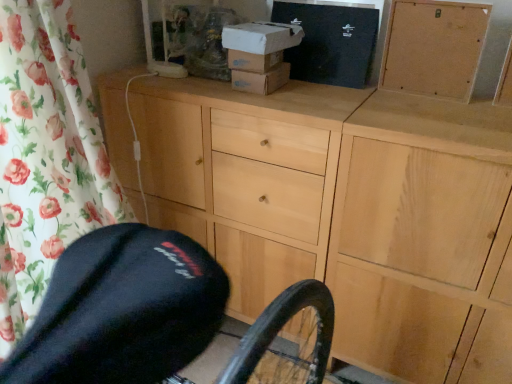
In order to face light wood cabinet at center, should I rotate leftwards or rightwards?

To align with it, rotate right about 8.072°.

How much space does white cardboard box at upper center, marked as the 1th box in a left-to-right arrangement, occupy vertically?

white cardboard box at upper center, marked as the 1th box in a left-to-right arrangement, is 7.62 inches tall.

Identify the location of black cardboard box at upper center, marked as the 1th box in a right-to-left arrangement. This screenshot has width=512, height=384. (330, 42).

Locate an element on the screen. Image resolution: width=512 pixels, height=384 pixels. light wood cabinet at center is located at coordinates (234, 172).

From the image's perspective, which one is positioned lower, light wood cabinet at center or corkboard at upper right?

light wood cabinet at center, from the image's perspective.

From a real-world perspective, which object rests below the other?

light wood cabinet at center, from a real-world perspective.

Is light wood cabinet at center facing away from corkboard at upper right?

No, light wood cabinet at center's orientation is not away from corkboard at upper right.

Which is more to the right, corkboard at upper right or white cardboard box at upper center, marked as the 1th box in a left-to-right arrangement?

corkboard at upper right is more to the right.

How many degrees apart are the facing directions of corkboard at upper right and white cardboard box at upper center, the second box when ordered from right to left?

There is a 3.28-degree angle between the facing directions of corkboard at upper right and white cardboard box at upper center, the second box when ordered from right to left.

Based on the photo, is corkboard at upper right next to white cardboard box at upper center, marked as the 1th box in a left-to-right arrangement, and touching it?

No, corkboard at upper right is not with white cardboard box at upper center, marked as the 1th box in a left-to-right arrangement.

From a real-world perspective, is corkboard at upper right over white cardboard box at upper center, the second box when ordered from right to left?

Yes, from a real-world perspective, corkboard at upper right is on top of white cardboard box at upper center, the second box when ordered from right to left.

Based on the photo, from a real-world perspective, relative to light wood cabinet at center, is corkboard at upper right vertically above or below?

Clearly, from a real-world perspective, corkboard at upper right is above light wood cabinet at center.

Based on their sizes in the image, would you say corkboard at upper right is bigger or smaller than light wood cabinet at center?

Considering their sizes, corkboard at upper right takes up less space than light wood cabinet at center.

Which of these two, corkboard at upper right or light wood cabinet at center, is wider?

light wood cabinet at center.

In the image, there is a corkboard at upper right. At what (x,y) coordinates should I click in order to perform the action: click on the chest of drawers below it (from the image's perspective). Please return your answer as a coordinate pair (x, y). Looking at the image, I should click on (234, 172).

Between point (269, 199) and point (249, 88), which one is positioned behind?

The point (269, 199) is farther.

Which of these two, light wood cabinet at center or white cardboard box at upper center, marked as the 1th box in a left-to-right arrangement, is bigger?

light wood cabinet at center is bigger.

Find the location of a particular element. The width and height of the screenshot is (512, 384). box that is the 2nd one when counting leftward from the light wood cabinet at center is located at coordinates (259, 54).

Which is more to the right, light wood cabinet at center or white cardboard box at upper center, marked as the 1th box in a left-to-right arrangement?

light wood cabinet at center.

Which of these two, white cardboard box at upper center, marked as the 1th box in a left-to-right arrangement, or black cardboard box at upper center, which ranks as the second box in left-to-right order, is wider?

white cardboard box at upper center, marked as the 1th box in a left-to-right arrangement, is wider.

Based on the photo, how distant is white cardboard box at upper center, the second box when ordered from right to left, from black cardboard box at upper center, which ranks as the second box in left-to-right order?

The distance of white cardboard box at upper center, the second box when ordered from right to left, from black cardboard box at upper center, which ranks as the second box in left-to-right order, is 6.38 inches.

Is white cardboard box at upper center, marked as the 1th box in a left-to-right arrangement, oriented towards black cardboard box at upper center, which ranks as the second box in left-to-right order?

No.

From a real-world perspective, is white cardboard box at upper center, marked as the 1th box in a left-to-right arrangement, positioned above or below black cardboard box at upper center, marked as the 1th box in a right-to-left arrangement?

In terms of real-world spatial position, white cardboard box at upper center, marked as the 1th box in a left-to-right arrangement, is below black cardboard box at upper center, marked as the 1th box in a right-to-left arrangement.

From the image's perspective, who appears lower, light wood cabinet at center or black cardboard box at upper center, marked as the 1th box in a right-to-left arrangement?

light wood cabinet at center, from the image's perspective.

Is black cardboard box at upper center, marked as the 1th box in a right-to-left arrangement, completely or partially inside light wood cabinet at center?

Actually, black cardboard box at upper center, marked as the 1th box in a right-to-left arrangement, is outside light wood cabinet at center.

Is light wood cabinet at center thinner than black cardboard box at upper center, which ranks as the second box in left-to-right order?

No.

From the image's perspective, who appears lower, white cardboard box at upper center, marked as the 1th box in a left-to-right arrangement, or corkboard at upper right?

corkboard at upper right.

In the image, is white cardboard box at upper center, the second box when ordered from right to left, on the left side or the right side of corkboard at upper right?

white cardboard box at upper center, the second box when ordered from right to left, is positioned on corkboard at upper right's left side.

Is white cardboard box at upper center, the second box when ordered from right to left, taller or shorter than corkboard at upper right?

Considering their sizes, white cardboard box at upper center, the second box when ordered from right to left, has less height than corkboard at upper right.

Is white cardboard box at upper center, the second box when ordered from right to left, turned away from corkboard at upper right?

white cardboard box at upper center, the second box when ordered from right to left, does not have its back to corkboard at upper right.

There is a light wood cabinet at center. Where is `cabinetry above it (from a real-world perspective)`? cabinetry above it (from a real-world perspective) is located at coordinates (434, 48).

This screenshot has height=384, width=512. In order to click on the 1st box behind the corkboard at upper right in this screenshot , I will do `click(259, 54)`.

From the image, which object appears to be nearer to light wood cabinet at center, white cardboard box at upper center, marked as the 1th box in a left-to-right arrangement, or black cardboard box at upper center, marked as the 1th box in a right-to-left arrangement?

Among the two, white cardboard box at upper center, marked as the 1th box in a left-to-right arrangement, is located nearer to light wood cabinet at center.

Estimate the real-world distances between objects in this image. Which object is further from white cardboard box at upper center, marked as the 1th box in a left-to-right arrangement, black cardboard box at upper center, marked as the 1th box in a right-to-left arrangement, or corkboard at upper right?

corkboard at upper right is further to white cardboard box at upper center, marked as the 1th box in a left-to-right arrangement.

Which object lies nearer to the anchor point corkboard at upper right, white cardboard box at upper center, the second box when ordered from right to left, or light wood cabinet at center?

white cardboard box at upper center, the second box when ordered from right to left, lies closer to corkboard at upper right than the other object.

From the image, which object appears to be farther from corkboard at upper right, light wood cabinet at center or white cardboard box at upper center, marked as the 1th box in a left-to-right arrangement?

The object further to corkboard at upper right is light wood cabinet at center.

From the image, which object appears to be nearer to corkboard at upper right, black cardboard box at upper center, marked as the 1th box in a right-to-left arrangement, or light wood cabinet at center?

black cardboard box at upper center, marked as the 1th box in a right-to-left arrangement.

From the image, which object appears to be farther from light wood cabinet at center, corkboard at upper right or black cardboard box at upper center, which ranks as the second box in left-to-right order?

The object further to light wood cabinet at center is corkboard at upper right.

Considering their positions, is light wood cabinet at center positioned closer to white cardboard box at upper center, marked as the 1th box in a left-to-right arrangement, than corkboard at upper right?

Based on the image, light wood cabinet at center appears to be nearer to white cardboard box at upper center, marked as the 1th box in a left-to-right arrangement.

Estimate the real-world distances between objects in this image. Which object is closer to light wood cabinet at center, white cardboard box at upper center, the second box when ordered from right to left, or corkboard at upper right?

white cardboard box at upper center, the second box when ordered from right to left, lies closer to light wood cabinet at center than the other object.

What are the coordinates of `box between white cardboard box at upper center, marked as the 1th box in a left-to-right arrangement, and corkboard at upper right from left to right` in the screenshot? It's located at (330, 42).

This screenshot has width=512, height=384. I want to click on cabinetry between black cardboard box at upper center, marked as the 1th box in a right-to-left arrangement, and light wood cabinet at center vertically, so click(x=434, y=48).

This screenshot has width=512, height=384. Identify the location of box between black cardboard box at upper center, which ranks as the second box in left-to-right order, and light wood cabinet at center in the up-down direction. (259, 54).

Locate an element on the screen. This screenshot has height=384, width=512. cabinetry between white cardboard box at upper center, the second box when ordered from right to left, and light wood cabinet at center vertically is located at coordinates (434, 48).